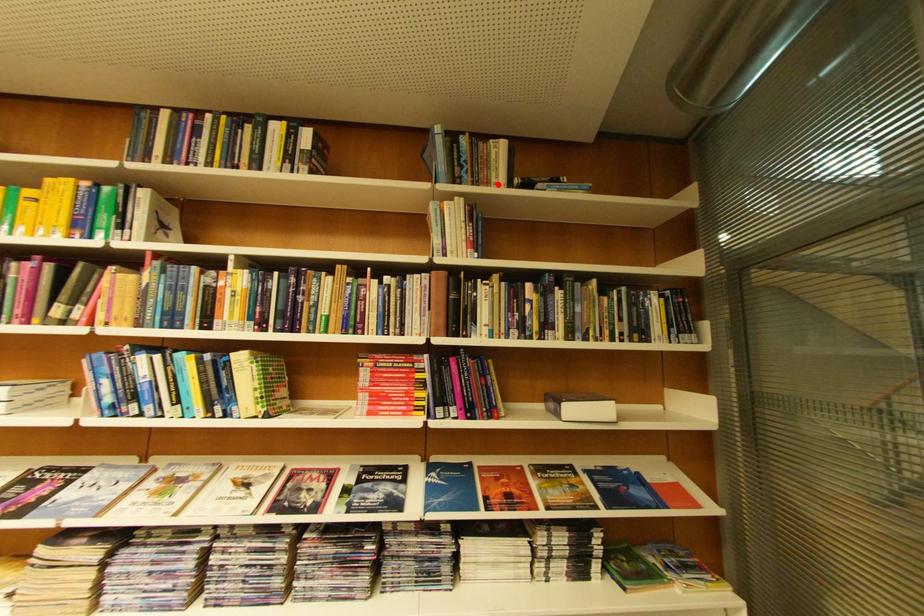
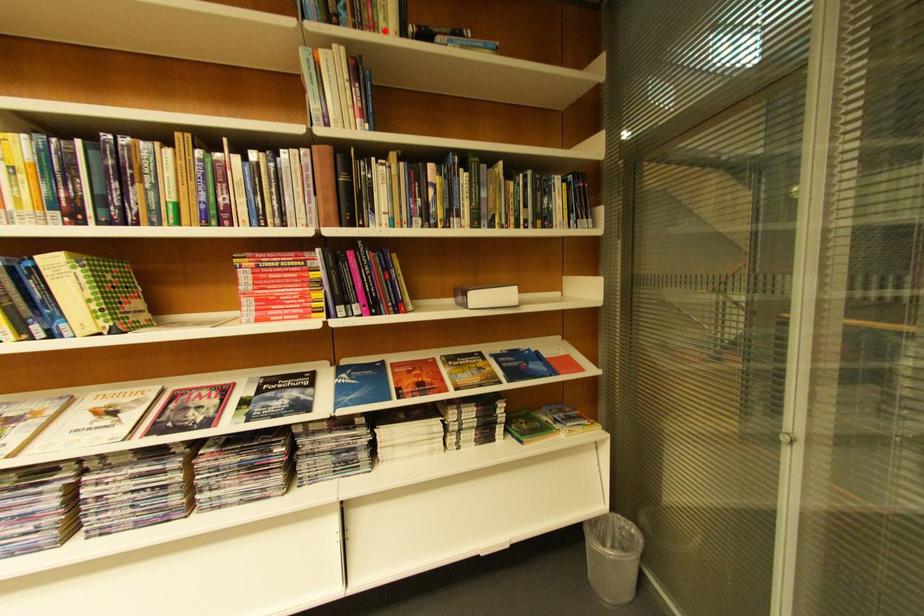
I am providing you with two images of the same scene from different viewpoints. A red point is marked on the first image and another point is marked on the second image. Does the point marked in image1 correspond to the same location as the one in image2?

Yes